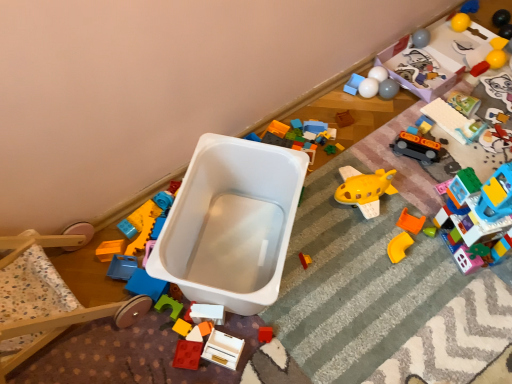
Find the location of a particular element. vacant area that lies between wooden toy box at center, arranged as the fourth toy when viewed from the left, and translucent plastic building blocks at right, arranged as the 5th toy when viewed from the right is located at coordinates (362, 285).